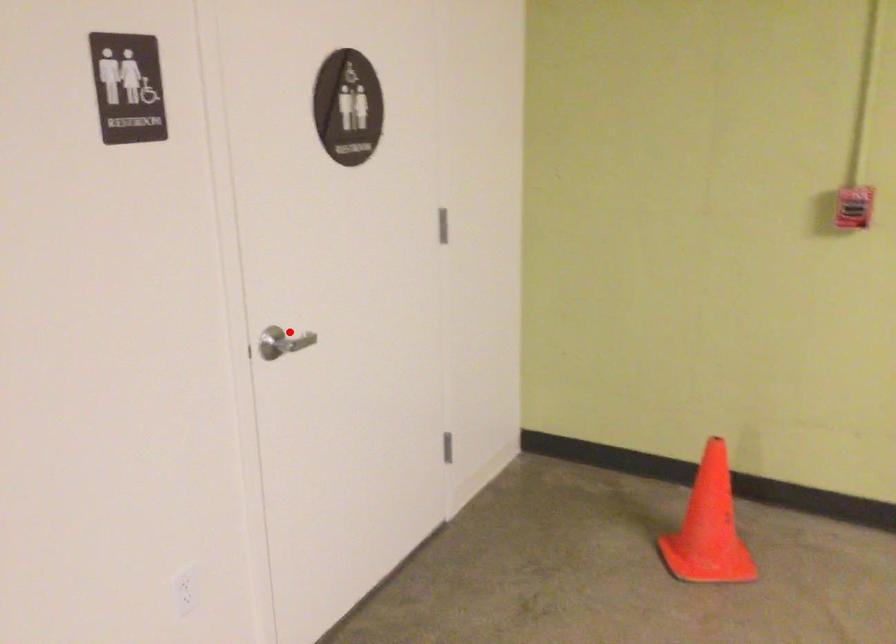
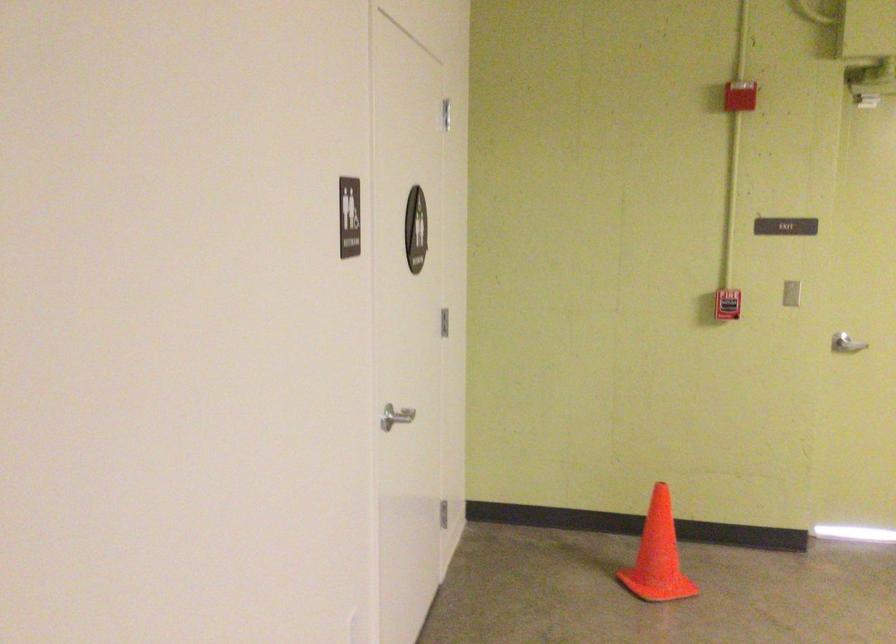
Where in the second image is the point corresponding to the highlighted location from the first image?

(394, 415)